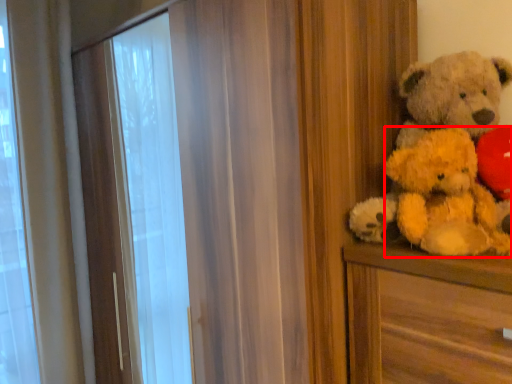
Question: From the image's perspective, where is teddy (annotated by the red box) located relative to teddy bear?

Choices:
 (A) below
 (B) above

Answer: (A)